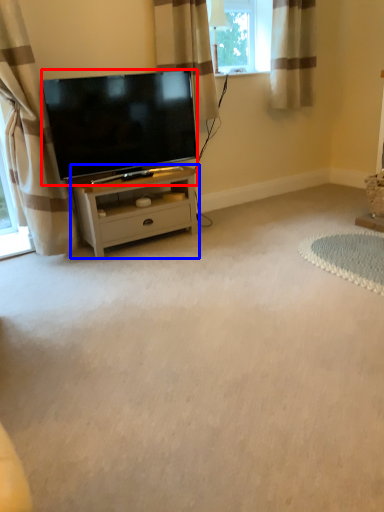
Question: Among these objects, which one is nearest to the camera, television (highlighted by a red box) or nightstand (highlighted by a blue box)?

Choices:
 (A) television
 (B) nightstand

Answer: (A)